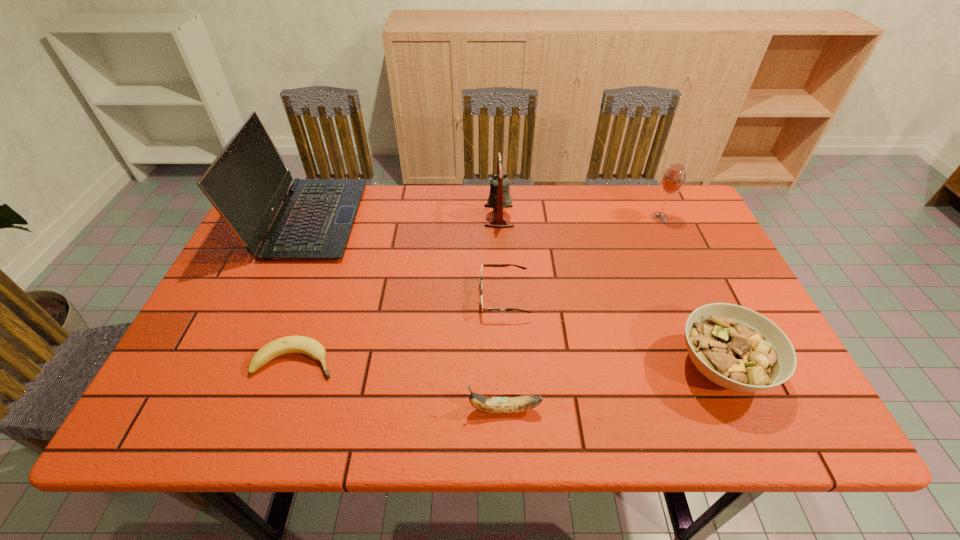
This screenshot has width=960, height=540. Find the location of `free space located at the stem of the farther banana`. free space located at the stem of the farther banana is located at coordinates (440, 361).

Identify the location of laptop computer that is at the far edge. This screenshot has width=960, height=540. (247, 182).

Find the location of a particular element. bell at the far edge is located at coordinates (499, 197).

Locate an element on the screen. This screenshot has width=960, height=540. wineglass that is at the far edge is located at coordinates [673, 179].

At what (x,y) coordinates should I click in order to perform the action: click on stew that is at the near edge. Please return your answer as a coordinate pair (x, y). Looking at the image, I should click on (737, 348).

Identify the location of banana positioned at the near edge. (497, 405).

At what (x,y) coordinates should I click in order to perform the action: click on object that is at the left edge. Please return your answer as a coordinate pair (x, y). Looking at the image, I should click on (247, 182).

Locate an element on the screen. This screenshot has width=960, height=540. wineglass that is at the right edge is located at coordinates (673, 179).

Identify the location of stew that is positioned at the right edge. The image size is (960, 540). (737, 348).

Where is `object present at the far left corner`? This screenshot has height=540, width=960. object present at the far left corner is located at coordinates (247, 182).